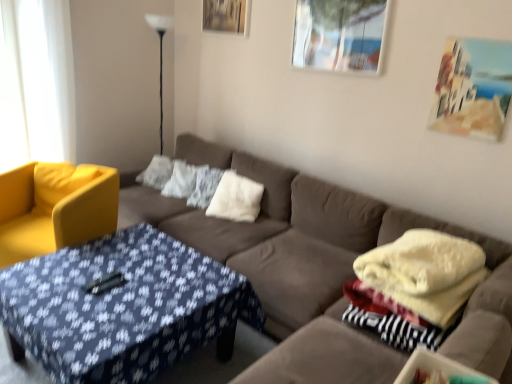
Question: Would you say blue fabric-covered coffee table at center is a long distance from black glass floor lamp at upper left?

Choices:
 (A) no
 (B) yes

Answer: (B)

Question: Does blue fabric-covered coffee table at center turn towards black glass floor lamp at upper left?

Choices:
 (A) yes
 (B) no

Answer: (B)

Question: Does blue fabric-covered coffee table at center appear on the left side of black glass floor lamp at upper left?

Choices:
 (A) no
 (B) yes

Answer: (A)

Question: Is blue fabric-covered coffee table at center outside of black glass floor lamp at upper left?

Choices:
 (A) yes
 (B) no

Answer: (A)

Question: Are blue fabric-covered coffee table at center and black glass floor lamp at upper left beside each other?

Choices:
 (A) no
 (B) yes

Answer: (A)

Question: Can you confirm if blue fabric-covered coffee table at center is positioned to the right of black glass floor lamp at upper left?

Choices:
 (A) no
 (B) yes

Answer: (B)

Question: Would you say metallic glass picture frame at upper right, positioned as the second picture frame in bottom-to-top order, is outside soft cream blanket at right?

Choices:
 (A) yes
 (B) no

Answer: (A)

Question: Does metallic glass picture frame at upper right, positioned as the second picture frame in back-to-front order, turn towards soft cream blanket at right?

Choices:
 (A) no
 (B) yes

Answer: (A)

Question: Is metallic glass picture frame at upper right, positioned as the second picture frame in bottom-to-top order, facing away from soft cream blanket at right?

Choices:
 (A) no
 (B) yes

Answer: (A)

Question: Does metallic glass picture frame at upper right, positioned as the second picture frame in bottom-to-top order, have a lesser width compared to soft cream blanket at right?

Choices:
 (A) yes
 (B) no

Answer: (A)

Question: Does metallic glass picture frame at upper right, positioned as the second picture frame in back-to-front order, have a greater width compared to soft cream blanket at right?

Choices:
 (A) yes
 (B) no

Answer: (B)

Question: Is metallic glass picture frame at upper right, which is the second picture frame in right-to-left order, bigger than soft cream blanket at right?

Choices:
 (A) no
 (B) yes

Answer: (A)

Question: Is black glass floor lamp at upper left turned away from white fluffy pillow at center, the third pillow in the left-to-right sequence?

Choices:
 (A) yes
 (B) no

Answer: (B)